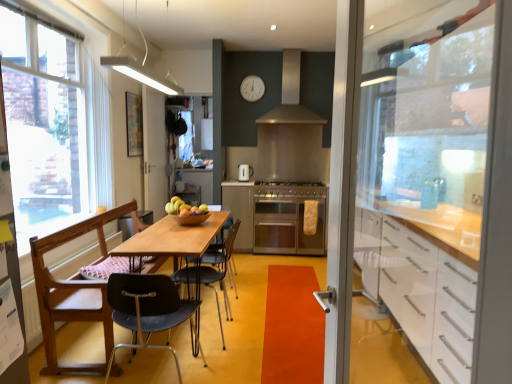
Question: Considering the positions of satin silver gas stove at center and matte white cabinet at center in the image, is satin silver gas stove at center taller or shorter than matte white cabinet at center?

Choices:
 (A) tall
 (B) short

Answer: (B)

Question: Considering the relative positions of satin silver gas stove at center and matte white cabinet at center in the image provided, is satin silver gas stove at center to the left or to the right of matte white cabinet at center?

Choices:
 (A) left
 (B) right

Answer: (B)

Question: Estimate the real-world distances between objects in this image. Which object is farther from the metallic silver kettle at center?

Choices:
 (A) black plastic chair at center, which is the 1th chair from back to front
 (B) orange matte door handle at center
 (C) matte wooden bowl at center
 (D) satin silver exhaust hood at upper center
 (E) transparent glass screen door at center, acting as the first screen door starting from the back

Answer: (B)

Question: Considering the real-world distances, which object is closest to the stainless steel oven at center?

Choices:
 (A) metallic silver kettle at center
 (B) transparent glass screen door at right, the first screen door from the right
 (C) matte white cabinet at center
 (D) wooden bowl at table
 (E) white plastic clock at upper center

Answer: (C)